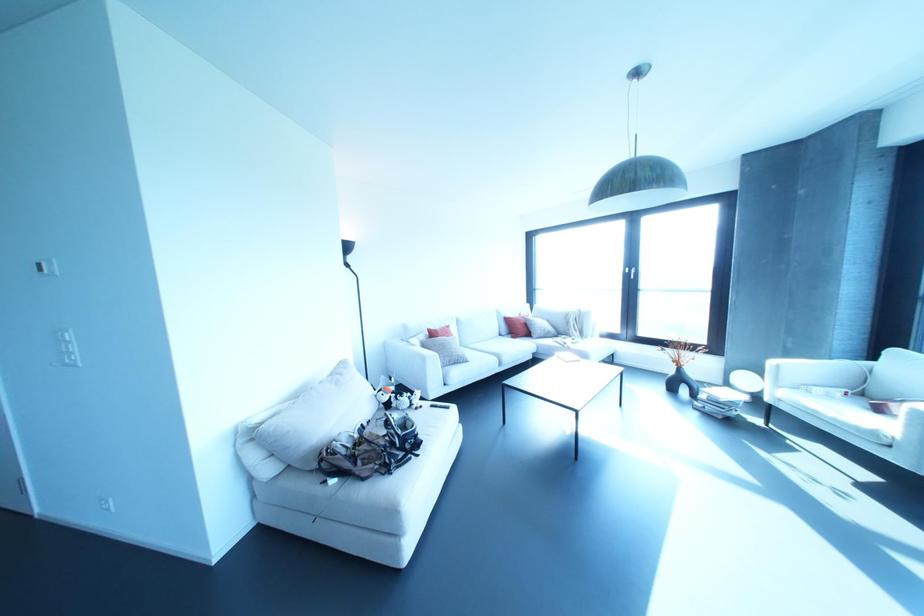
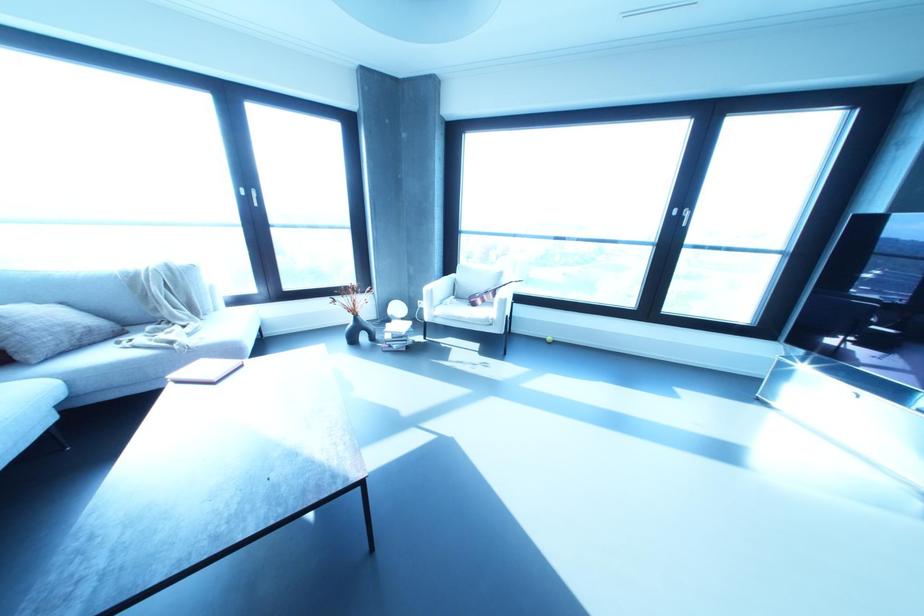
Find the pixel in the second image that matches point 693,395 in the first image.

(371, 338)